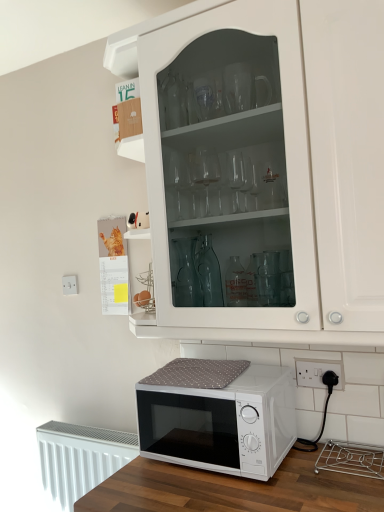
Question: Is white matte microwave at lower center taller or shorter than white glass cabinet at upper center?

Choices:
 (A) short
 (B) tall

Answer: (A)

Question: From the image's perspective, is white matte microwave at lower center located above or below white glass cabinet at upper center?

Choices:
 (A) below
 (B) above

Answer: (A)

Question: Estimate the real-world distances between objects in this image. Which object is closer to the white glass cabinet at upper center?

Choices:
 (A) white plastic electric outlet at lower right, the 2th electric outlet from the front
 (B) white textured radiator at lower left
 (C) white plastic electric outlet at lower right, which is the 2th electric outlet from left to right
 (D) white matte microwave at lower center

Answer: (D)

Question: Based on their relative distances, which object is farther from the white glass cabinet at upper center?

Choices:
 (A) white plastic electric outlet at lower right, which is the first electric outlet from top to bottom
 (B) white matte microwave at lower center
 (C) white plastic electric outlet at lower right, acting as the first electric outlet starting from the bottom
 (D) white textured radiator at lower left

Answer: (A)